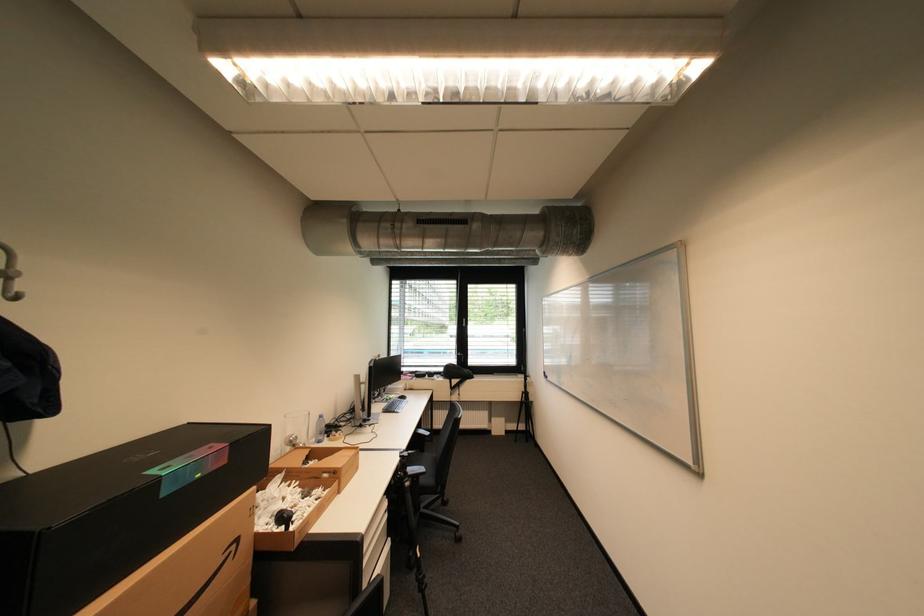
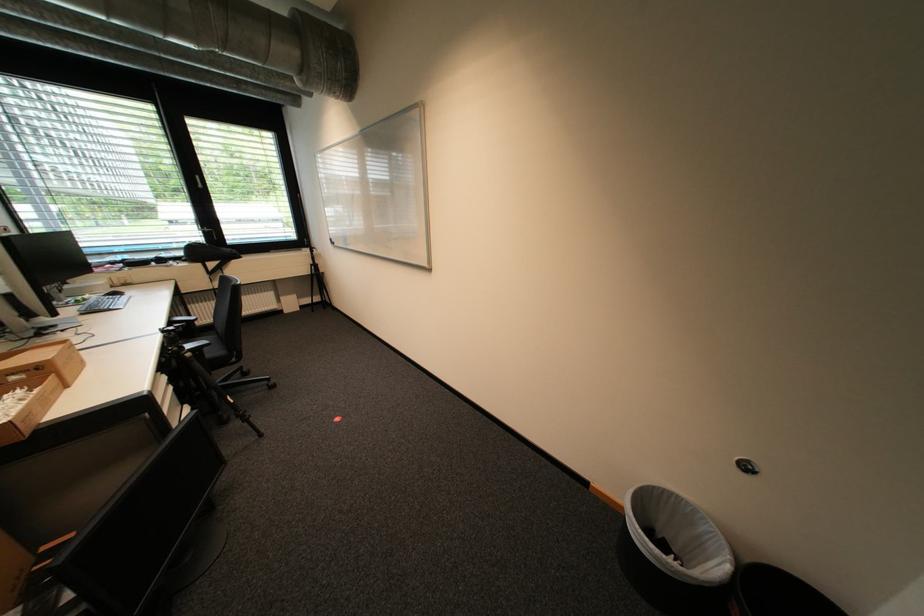
Find the pixel in the second image that matches (x=410, y=475) in the first image.

(185, 349)